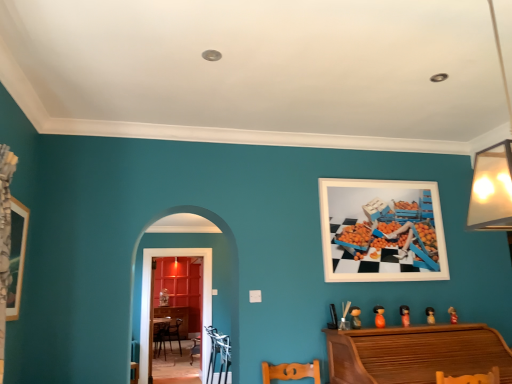
The height and width of the screenshot is (384, 512). I want to click on empty space that is to the right of orange matte doll at lower right, which is counted as the third toy, starting from the left, so click(x=423, y=326).